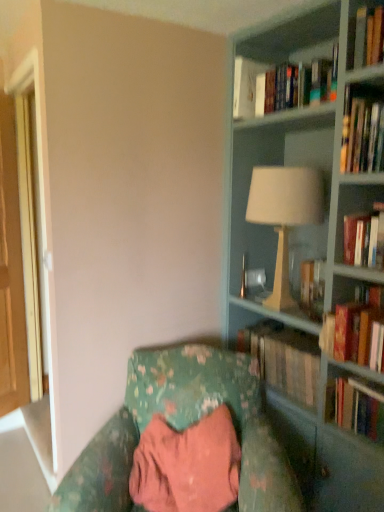
Question: Would you say hardcover book at center, the second book positioned from the bottom, is inside or outside hardcover book at right, the third book when ordered from bottom to top?

Choices:
 (A) inside
 (B) outside

Answer: (B)

Question: Would you say hardcover book at center, the second book positioned from the bottom, is to the left or to the right of hardcover book at right, the third book when ordered from bottom to top, in the picture?

Choices:
 (A) right
 (B) left

Answer: (B)

Question: Estimate the real-world distances between objects in this image. Which object is farther from the brown wooden door at left?

Choices:
 (A) hardcover books at upper right, which is the 2th book from top to bottom
 (B) white ceramic lamp at upper right
 (C) hardcover book at right, which is the third book from top to bottom
 (D) hardcover book at right, which appears as the 5th book when viewed from the top
 (E) floral fabric chair at lower center

Answer: (D)

Question: Which of these objects is positioned closest to the hardcover book at center, marked as the 4th book in a top-to-bottom arrangement?

Choices:
 (A) hardcover book at right, the third book when ordered from bottom to top
 (B) white ceramic lamp at upper right
 (C) hardcover book at right, which appears as the 5th book when viewed from the top
 (D) matte gray bookcase at right
 (E) white paper at upper center, the 5th book in the bottom-to-top sequence

Answer: (C)